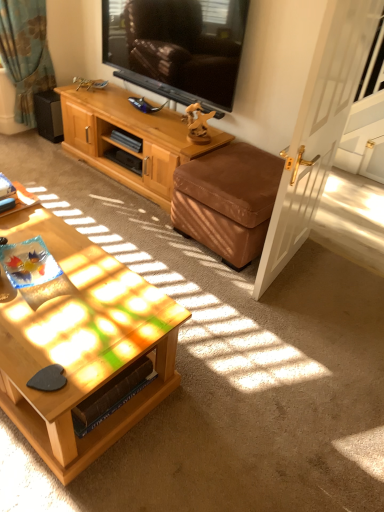
Locate an element on the screen. The height and width of the screenshot is (512, 384). vacant area that is situated to the right of wooden desk at lower left is located at coordinates (41, 220).